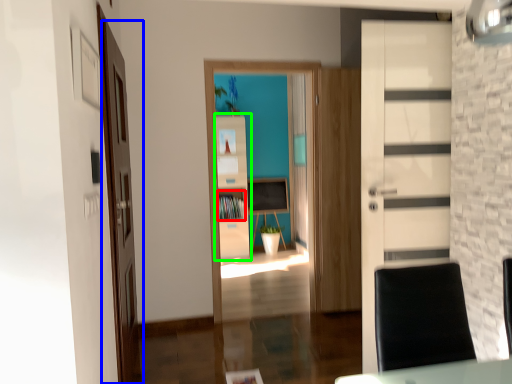
Question: Which object is positioned closest to cabinet (highlighted by a red box)? Select from door (highlighted by a blue box) and cabinetry (highlighted by a green box).

Choices:
 (A) door
 (B) cabinetry

Answer: (B)